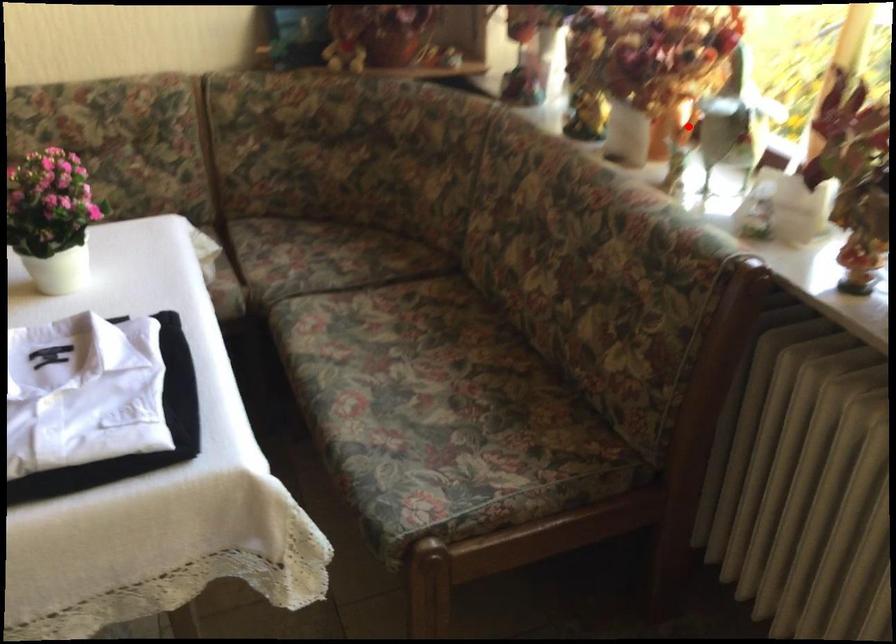
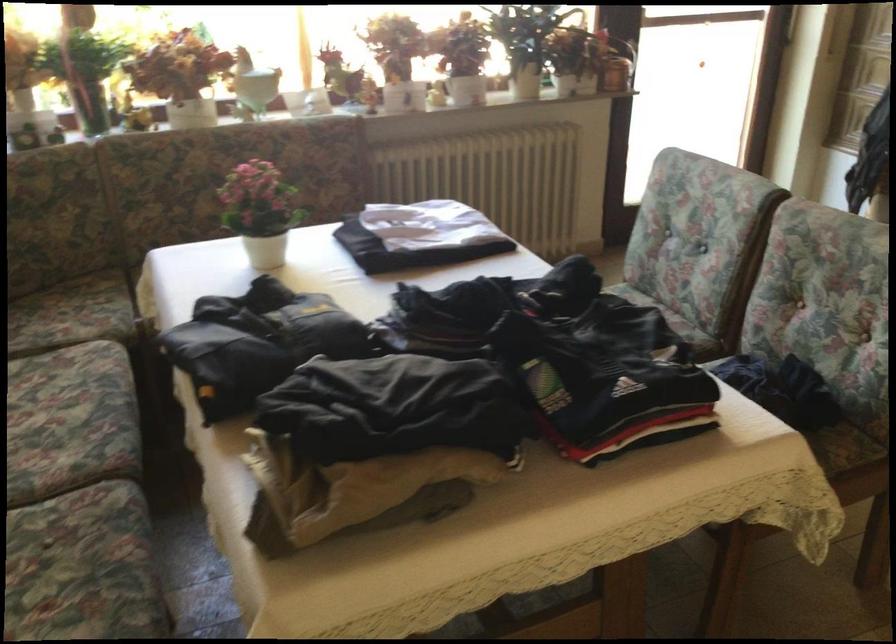
Where in the second image is the point corresponding to the highlighted location from the first image?

(252, 84)